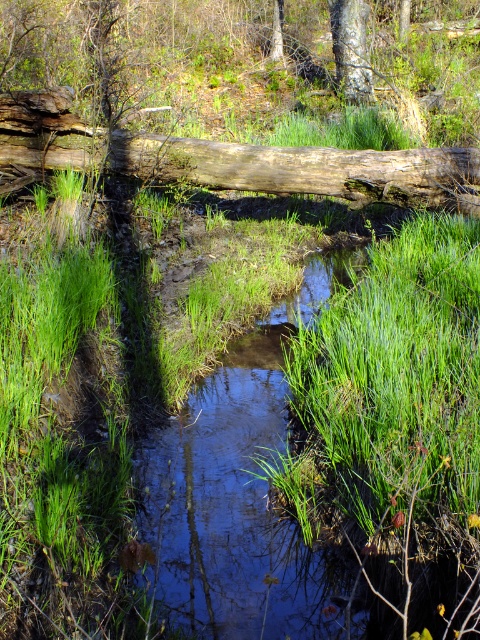
Between point (252, 545) and point (370, 72), which one is positioned behind?

The point (370, 72) is behind.

Which of these two, clear water stream at center or smooth gray tree trunk at upper center, stands taller?

smooth gray tree trunk at upper center is taller.

Find the location of `clear water stream at center`. clear water stream at center is located at coordinates (x=239, y=493).

Is the position of clear water stream at center less distant than that of weathered brown log at center?

That is True.

Does clear water stream at center have a lesser width compared to weathered brown log at center?

Yes, clear water stream at center is thinner than weathered brown log at center.

I want to click on clear water stream at center, so click(239, 493).

Can you confirm if weathered brown log at center is positioned to the left of smooth gray tree trunk at upper center?

Yes, weathered brown log at center is to the left of smooth gray tree trunk at upper center.

Does weathered brown log at center lie in front of smooth gray tree trunk at upper center?

Yes, it is.

Measure the distance between weathered brown log at center and camera.

weathered brown log at center and camera are 5.07 meters apart from each other.

Image resolution: width=480 pixels, height=640 pixels. Identify the location of weathered brown log at center. (307, 170).